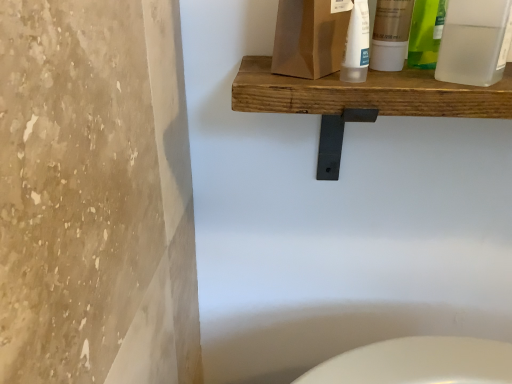
Question: Based on their sizes in the image, would you say wooden shelf at upper center is bigger or smaller than translucent plastic tube at upper center, the second cleaning product when ordered from left to right?

Choices:
 (A) big
 (B) small

Answer: (A)

Question: Is point (444, 102) closer or farther from the camera than point (346, 56)?

Choices:
 (A) farther
 (B) closer

Answer: (B)

Question: Which of these objects is positioned farthest from the translucent plastic tube at upper center, marked as the first cleaning product in a right-to-left arrangement?

Choices:
 (A) matte white tube at upper center, marked as the second mouthwash in a right-to-left arrangement
 (B) translucent plastic bottle at upper center, the second cleaning product positioned from the right
 (C) wooden shelf at upper center
 (D) transparent plastic bottle at upper right, acting as the 1th mouthwash starting from the right

Answer: (D)

Question: Which of these objects is positioned farthest from the wooden shelf at upper center?

Choices:
 (A) translucent plastic bottle at upper center, which ranks as the first cleaning product in left-to-right order
 (B) matte white tube at upper center, marked as the second mouthwash in a right-to-left arrangement
 (C) transparent plastic bottle at upper right, acting as the 1th mouthwash starting from the right
 (D) translucent plastic tube at upper center, marked as the first cleaning product in a right-to-left arrangement

Answer: (B)